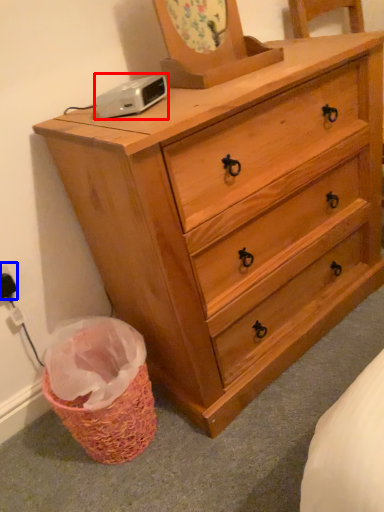
Question: Among these objects, which one is farthest to the camera, gadget (highlighted by a red box) or electric outlet (highlighted by a blue box)?

Choices:
 (A) gadget
 (B) electric outlet

Answer: (B)